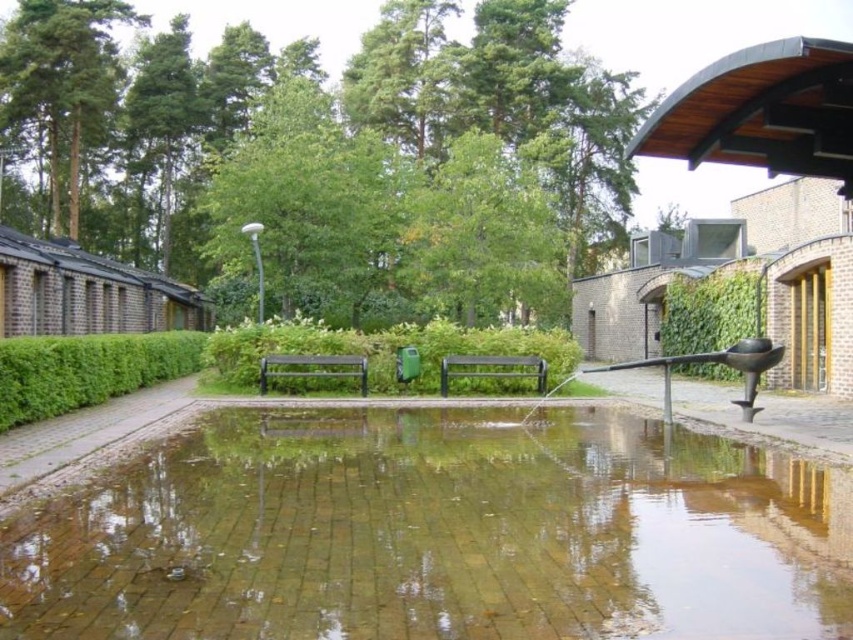
Is green leafy tree at upper center to the left of green leafy hedge at left from the viewer's perspective?

Yes, green leafy tree at upper center is to the left of green leafy hedge at left.

Which of these two, green leafy tree at upper center or green leafy hedge at left, stands taller?

With more height is green leafy tree at upper center.

Image resolution: width=853 pixels, height=640 pixels. In order to click on green leafy tree at upper center in this screenshot , I will do `click(326, 156)`.

Can you confirm if green leafy tree at upper left is positioned to the left of black polished water at center?

Indeed, green leafy tree at upper left is positioned on the left side of black polished water at center.

Does green leafy tree at upper left appear under black polished water at center?

No.

Is point (76, 212) farther from camera compared to point (701, 394)?

Yes, it is behind point (701, 394).

Find the location of a particular element. This screenshot has width=853, height=640. green leafy tree at upper left is located at coordinates (62, 88).

Which is behind, point (764, 568) or point (689, 305)?

Positioned behind is point (689, 305).

Between point (593, 636) and point (686, 321), which one is positioned in front?

Positioned in front is point (593, 636).

Find the location of `clear water at center`. clear water at center is located at coordinates (438, 532).